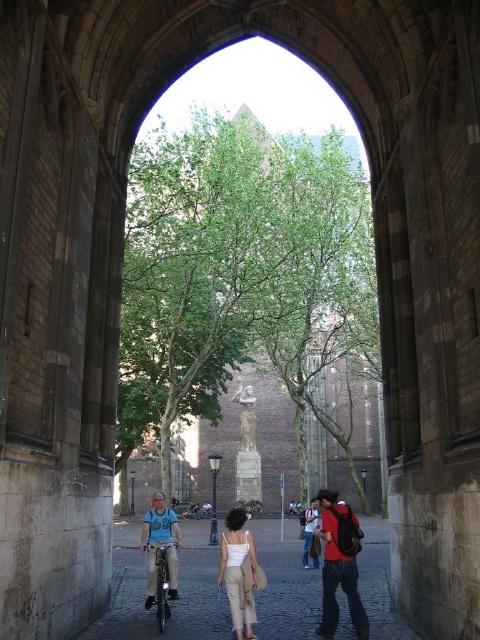
Question: Considering the real-world distances, which object is closest to the matte blue shirt at center?

Choices:
 (A) beige cotton pants at center
 (B) matte beige pants at lower center
 (C) smooth stone statue at center
 (D) matte red backpack at center

Answer: (A)

Question: Can you confirm if green leafy tree at center is positioned above smooth stone statue at center?

Choices:
 (A) yes
 (B) no

Answer: (A)

Question: Does matte beige pants at lower center have a larger size compared to matte blue shirt at center?

Choices:
 (A) no
 (B) yes

Answer: (B)

Question: Based on their relative distances, which object is nearer to the matte blue shirt at center?

Choices:
 (A) smooth stone statue at center
 (B) denim jacket at lower center

Answer: (B)

Question: Considering the real-world distances, which object is closest to the matte beige pants at lower center?

Choices:
 (A) green leafy tree at center
 (B) beige cotton pants at center
 (C) smooth stone statue at center

Answer: (B)

Question: Can you confirm if matte red backpack at center is positioned below denim jacket at lower center?

Choices:
 (A) yes
 (B) no

Answer: (B)